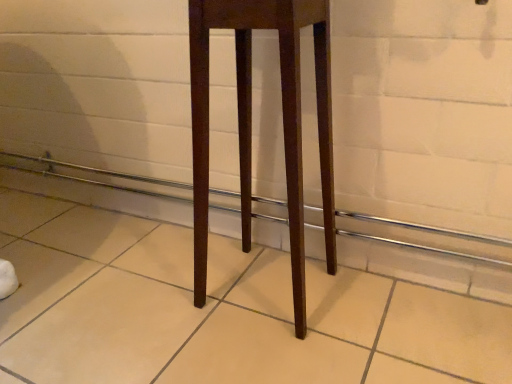
Question: Is brown wooden balustrade at center surrounded by mahogany wood stool at center?

Choices:
 (A) yes
 (B) no

Answer: (B)

Question: From a real-world perspective, is mahogany wood stool at center physically below brown wooden balustrade at center?

Choices:
 (A) no
 (B) yes

Answer: (A)

Question: Does mahogany wood stool at center have a greater height compared to brown wooden balustrade at center?

Choices:
 (A) no
 (B) yes

Answer: (B)

Question: From the image's perspective, is mahogany wood stool at center located beneath brown wooden balustrade at center?

Choices:
 (A) no
 (B) yes

Answer: (A)

Question: Is the depth of mahogany wood stool at center greater than that of brown wooden balustrade at center?

Choices:
 (A) no
 (B) yes

Answer: (A)

Question: From the image's perspective, is mahogany wood stool at center on top of brown wooden balustrade at center?

Choices:
 (A) yes
 (B) no

Answer: (A)

Question: Is brown wooden balustrade at center located outside mahogany wood stool at center?

Choices:
 (A) no
 (B) yes

Answer: (B)

Question: Considering the relative sizes of brown wooden balustrade at center and mahogany wood stool at center in the image provided, is brown wooden balustrade at center bigger than mahogany wood stool at center?

Choices:
 (A) no
 (B) yes

Answer: (A)

Question: From the image's perspective, is brown wooden balustrade at center over mahogany wood stool at center?

Choices:
 (A) no
 (B) yes

Answer: (A)

Question: Considering the relative sizes of brown wooden balustrade at center and mahogany wood stool at center in the image provided, is brown wooden balustrade at center thinner than mahogany wood stool at center?

Choices:
 (A) no
 (B) yes

Answer: (B)

Question: Does brown wooden balustrade at center have a greater height compared to mahogany wood stool at center?

Choices:
 (A) yes
 (B) no

Answer: (B)

Question: Can you confirm if brown wooden balustrade at center is positioned to the left of mahogany wood stool at center?

Choices:
 (A) yes
 (B) no

Answer: (A)

Question: Considering their positions, is brown wooden balustrade at center located in front of or behind mahogany wood stool at center?

Choices:
 (A) front
 (B) behind

Answer: (B)